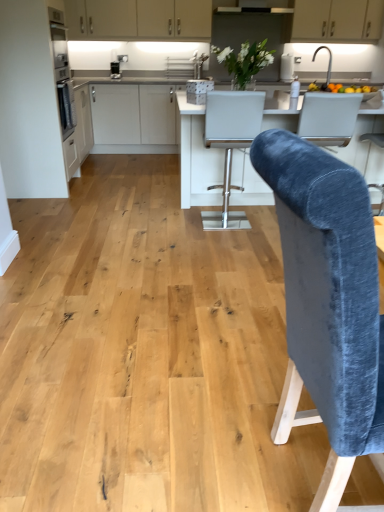
In order to click on vacant space underneath velvet blue chair at center, positioned as the second chair in top-to-bottom order (from a real-world perspective) in this screenshot , I will do `click(299, 471)`.